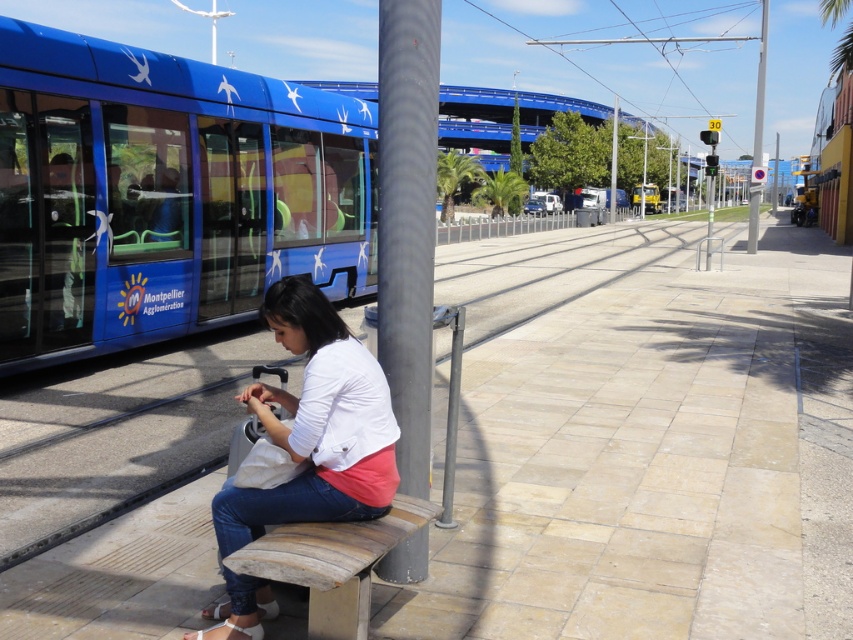
Question: Which of the following is the farthest from the observer?

Choices:
 (A) wooden bench at center
 (B) white cotton shirt at center

Answer: (B)

Question: Is blue glossy tram at left thinner than metallic pole at center?

Choices:
 (A) no
 (B) yes

Answer: (B)

Question: Can you confirm if metallic pole at upper right is positioned to the right of metallic pole at center?

Choices:
 (A) yes
 (B) no

Answer: (A)

Question: Does blue glossy tram at left appear over metallic pole at center?

Choices:
 (A) yes
 (B) no

Answer: (B)

Question: Which is nearer to the metallic pole at upper right?

Choices:
 (A) white cotton shirt at center
 (B) blue glossy tram at left

Answer: (B)

Question: Among these points, which one is farthest from the camera?

Choices:
 (A) (749, 237)
 (B) (608, 214)

Answer: (B)